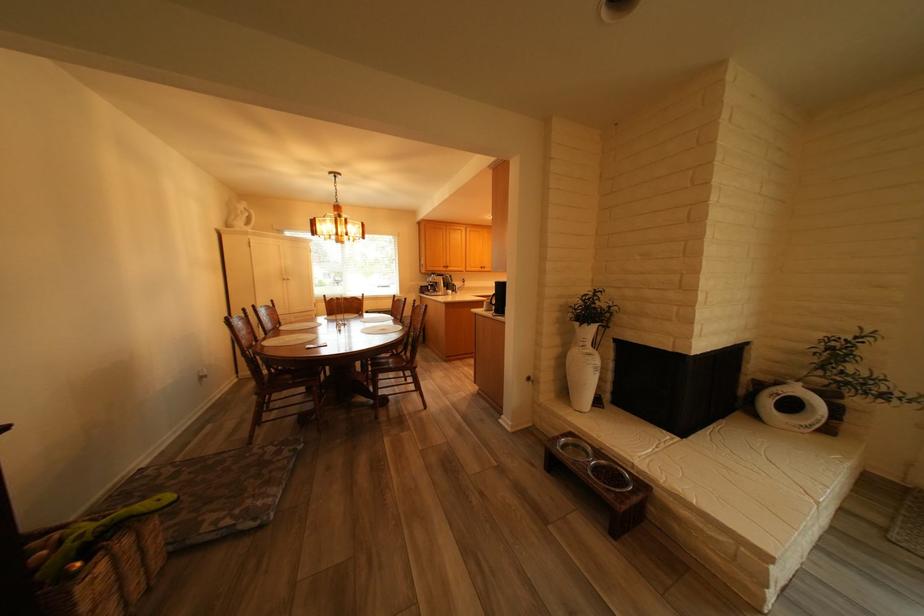
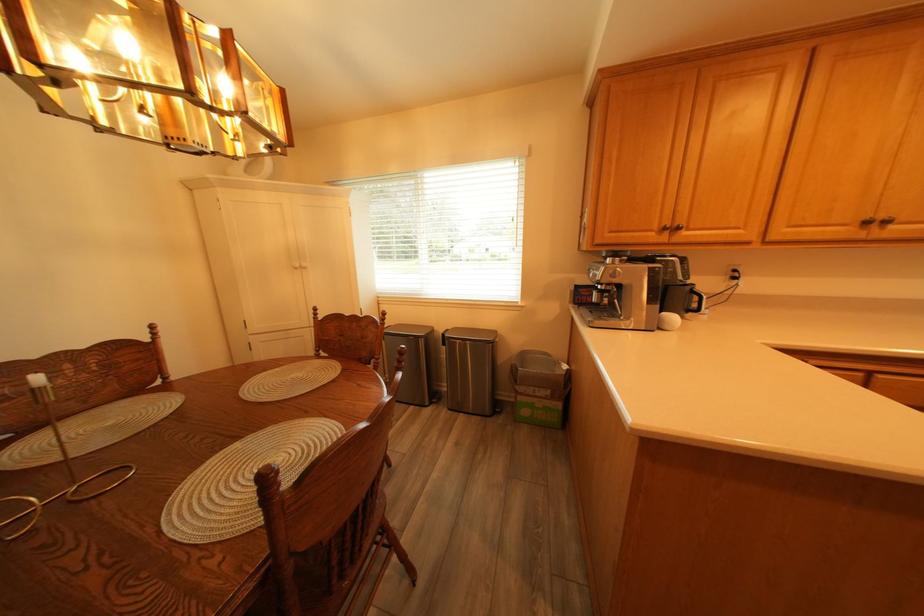
Find the pixel in the second image that matches (x=495, y=268) in the first image.

(881, 224)